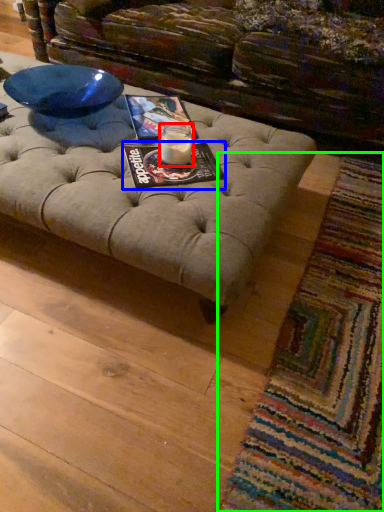
Question: Based on their relative distances, which object is nearer to candle holder (highlighted by a red box)? Choose from magazine (highlighted by a blue box) and mat (highlighted by a green box).

Choices:
 (A) magazine
 (B) mat

Answer: (A)